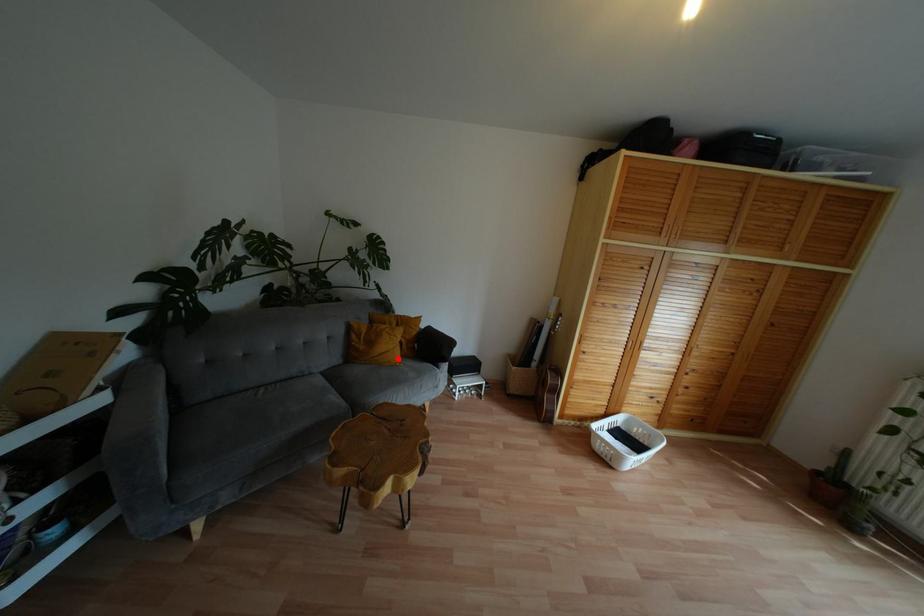
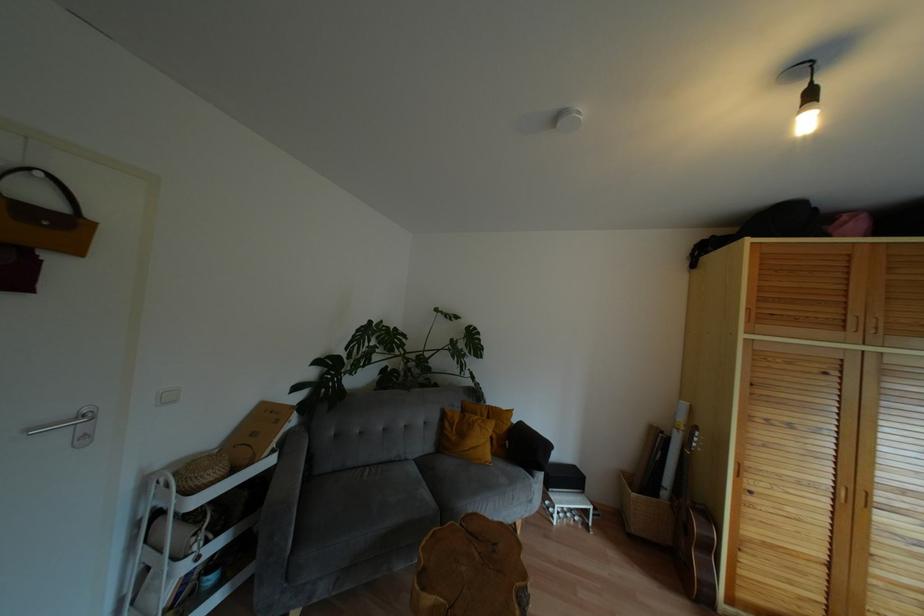
Question: I am providing you with two images of the same scene from different viewpoints. In image1, a red point is highlighted. Considering the same 3D point in image2, which of the following is correct?

Choices:
 (A) It is closer
 (B) It is farther

Answer: (B)